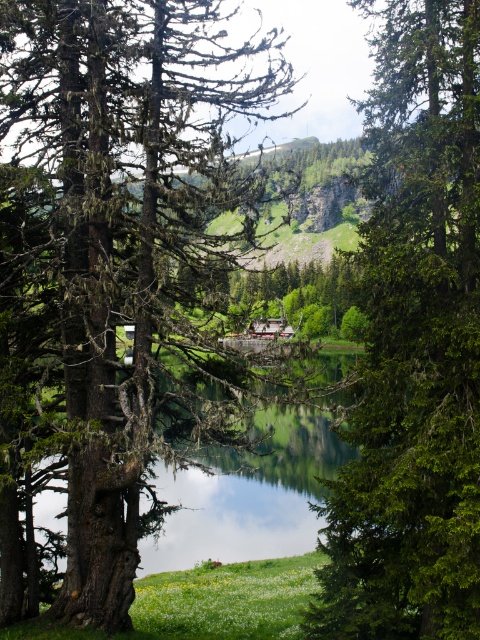
You are standing at the center of the image and want to locate the green mossy tree at left. Which direction should you look to find it?

The green mossy tree at left is located at point 0.416 on the x axis and 0.242 on the y axis. Since the x coordinate is 0.416, which is less than 0.5, it is to the left of the center. The y coordinate 0.242 is also below the center y of 0.5, so it is lower than the center. Therefore, you should look to the lower left direction to find the green mossy tree at left.

You are standing at the edge of the green grassy field at lower center and want to take a photo of the green mossy tree at left. Which object should you focus on first to ensure both are in the frame?

You should focus on the green mossy tree at left first because it is larger than the green grassy field at lower center, so it will require more attention to frame properly.

You are standing at the edge of the lake in the serene landscape scene. You notice two points marked in the image. One is at coordinate point [14,513] and the other is at point [204,627]. Which of these two points is nearer to your current position?

Point [14,513] is closer to the viewer than point [204,627], so the point at coordinates [14,513] is nearer to your current position.